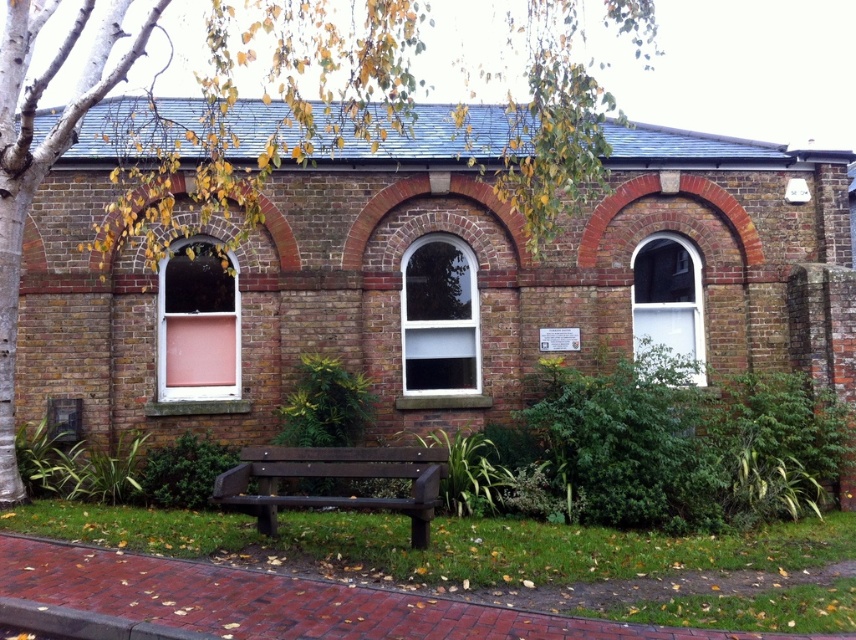
Between green leafy tree at upper left and brown wooden bench at center, which one has more height?

Standing taller between the two is green leafy tree at upper left.

Who is more distant from viewer, (10, 237) or (343, 460)?

Positioned behind is point (10, 237).

This screenshot has width=856, height=640. In order to click on green leafy tree at upper left in this screenshot , I will do `click(268, 102)`.

Consider the image. Does brown wooden bench at center have a larger size compared to white glass window at upper right?

Yes.

Is brown wooden bench at center thinner than white glass window at upper right?

No, brown wooden bench at center is not thinner than white glass window at upper right.

Does point (352, 468) lie behind point (639, 324)?

No.

Locate an element on the screen. Image resolution: width=856 pixels, height=640 pixels. brown wooden bench at center is located at coordinates (334, 477).

Is brown wooden bench at center to the left of white glass window at center from the viewer's perspective?

Yes, brown wooden bench at center is to the left of white glass window at center.

Is brown wooden bench at center above white glass window at center?

No.

Is point (263, 524) positioned before point (409, 355)?

Yes, point (263, 524) is in front of point (409, 355).

You are a GUI agent. You are given a task and a screenshot of the screen. Output one action in this format:
    pyautogui.click(x=<x>, y=<y>)
    Task: Click on the brown wooden bench at center
    The image size is (856, 640).
    Given the screenshot: What is the action you would take?
    pyautogui.click(x=334, y=477)